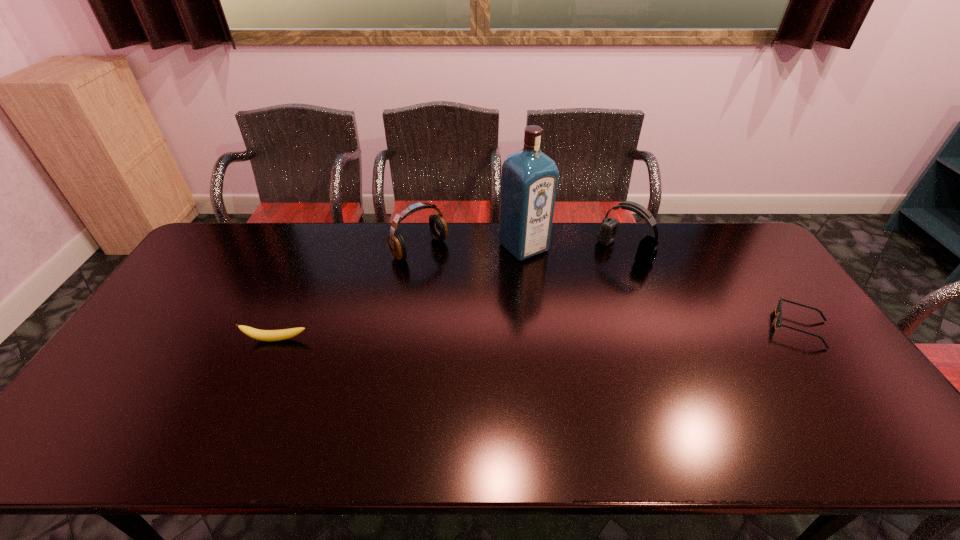
Identify the location of free space located 0.300m on the headband of the right headset. The height and width of the screenshot is (540, 960). (553, 307).

Locate an element on the screen. The height and width of the screenshot is (540, 960). liquor that is at the far edge is located at coordinates click(x=529, y=179).

Locate an element on the screen. object that is at the right edge is located at coordinates (778, 323).

Locate an element on the screen. Image resolution: width=960 pixels, height=540 pixels. free space at the far edge of the desktop is located at coordinates (341, 246).

Locate an element on the screen. This screenshot has height=540, width=960. vacant space at the near edge is located at coordinates (217, 407).

Where is `vacant space at the left edge`? The height and width of the screenshot is (540, 960). vacant space at the left edge is located at coordinates (190, 275).

Find the location of a particular element. This screenshot has width=960, height=540. vacant region at the far left corner of the desktop is located at coordinates 214,237.

At what (x,y) coordinates should I click in order to perform the action: click on free space between the rightmost object and the left headset. Please return your answer as a coordinate pair (x, y). Looking at the image, I should click on (610, 288).

I want to click on unoccupied position between the left headset and the shortest object, so click(610, 288).

You are a GUI agent. You are given a task and a screenshot of the screen. Output one action in this format:
    pyautogui.click(x=<x>, y=<y>)
    Task: Click on the vacant space that's between the right headset and the leftmost object
    The height and width of the screenshot is (540, 960).
    Given the screenshot: What is the action you would take?
    (450, 295)